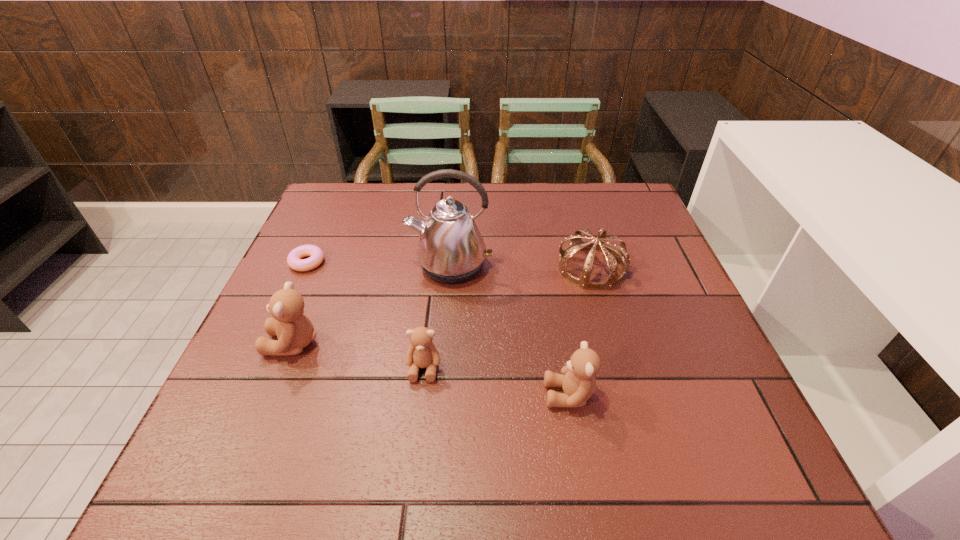
Locate an element on the screen. vacant position located 0.220m on the face of the rightmost teddy bear is located at coordinates pyautogui.click(x=431, y=395).

Find the location of a particular element. vacant space located 0.290m on the face of the rightmost teddy bear is located at coordinates (395, 395).

This screenshot has height=540, width=960. I want to click on vacant space located 0.220m on the back of the tiara, so click(x=573, y=202).

Where is `free space located 0.060m on the back of the kettle`? free space located 0.060m on the back of the kettle is located at coordinates (453, 232).

Locate an element on the screen. This screenshot has height=540, width=960. vacant space located on the back of the doughnut is located at coordinates (340, 191).

Find the location of a particular element. Image resolution: width=960 pixels, height=540 pixels. object at the near edge is located at coordinates (578, 381).

Locate an element on the screen. This screenshot has height=540, width=960. teddy bear located in the left edge section of the desktop is located at coordinates (294, 330).

The width and height of the screenshot is (960, 540). In order to click on doughnut positioned at the left edge in this screenshot , I will do `click(294, 259)`.

Locate an element on the screen. The height and width of the screenshot is (540, 960). object present at the right edge is located at coordinates (612, 255).

Identify the location of vacant space at the far edge of the desktop. (409, 187).